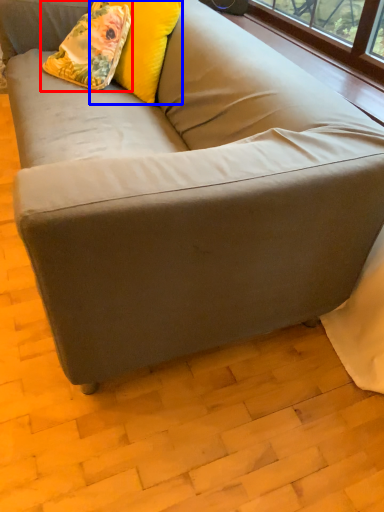
Question: Which point is closer to the camera, throw pillow (highlighted by a red box) or pillow (highlighted by a blue box)?

Choices:
 (A) throw pillow
 (B) pillow

Answer: (B)